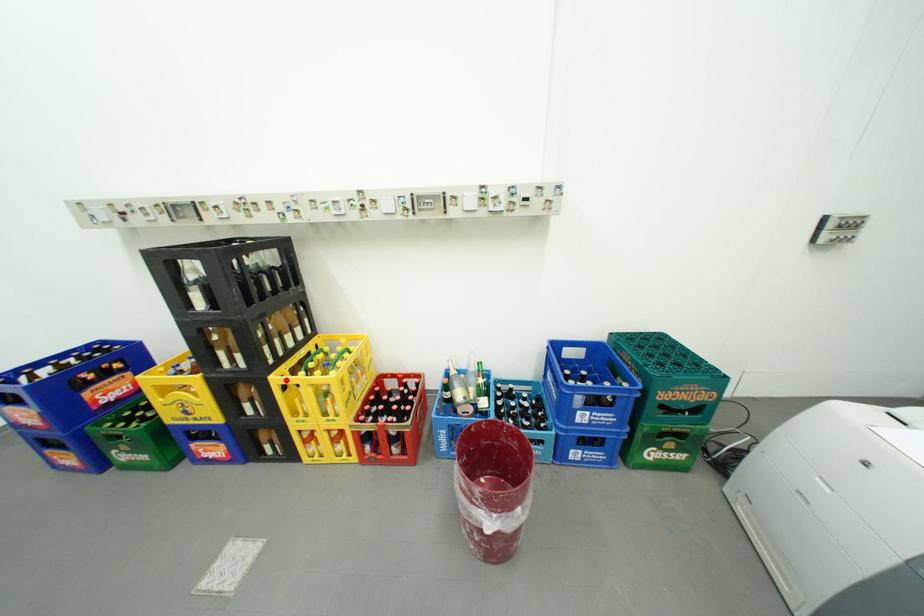
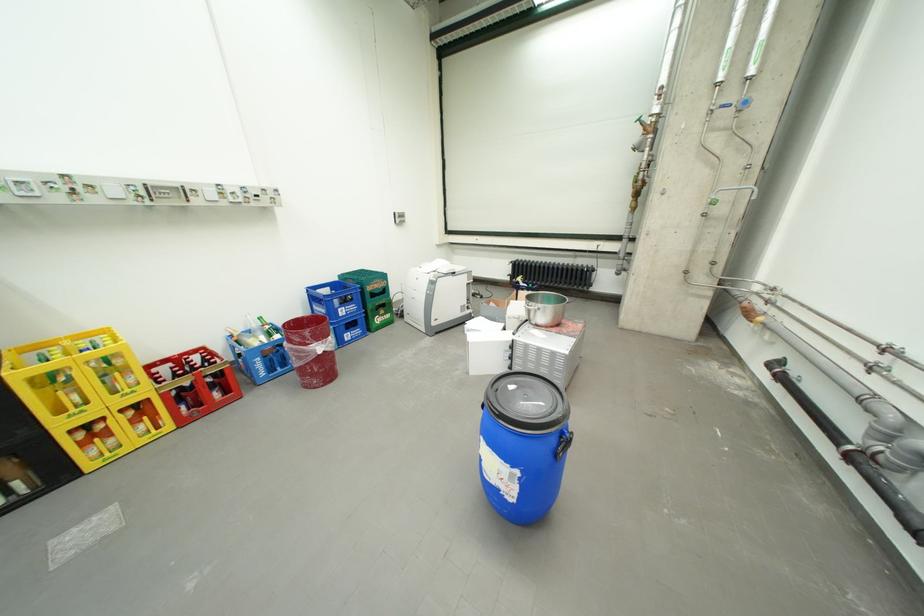
Question: I am providing you with two images of the same scene from different viewpoints. A red point is shown in image1. For the corresponding object point in image2, is it positioned nearer or farther from the camera?

Choices:
 (A) Nearer
 (B) Farther

Answer: (B)